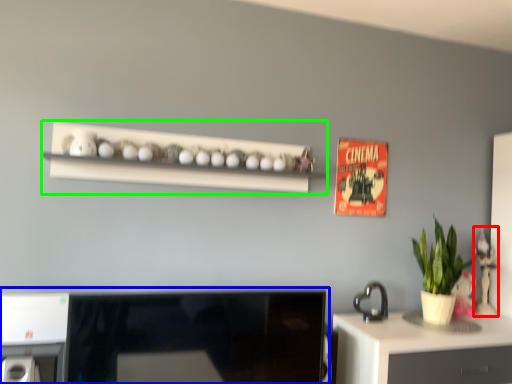
Question: Considering the real-world distances, which object is farthest from toy (highlighted by a red box)? desktop (highlighted by a blue box) or shelf (highlighted by a green box)?

Choices:
 (A) desktop
 (B) shelf

Answer: (A)